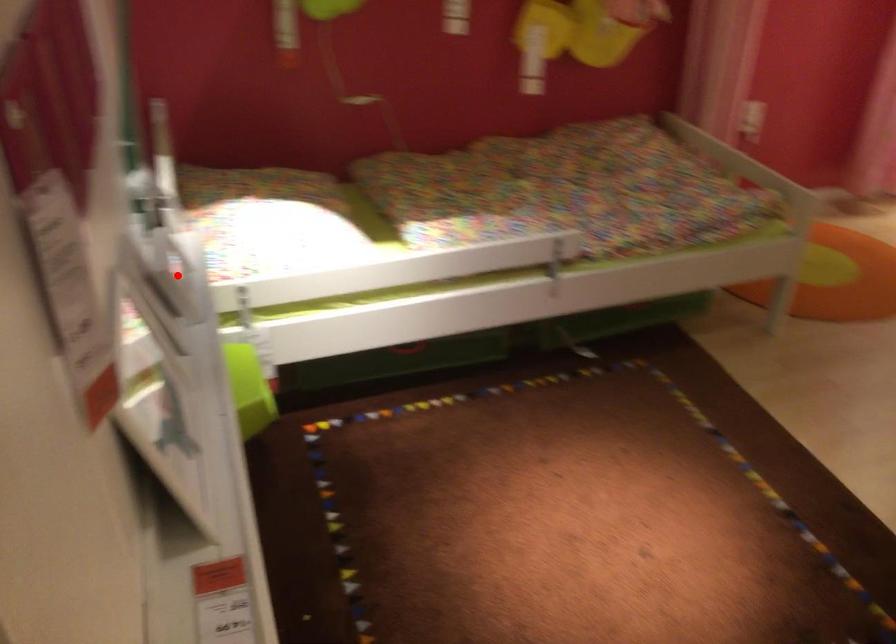
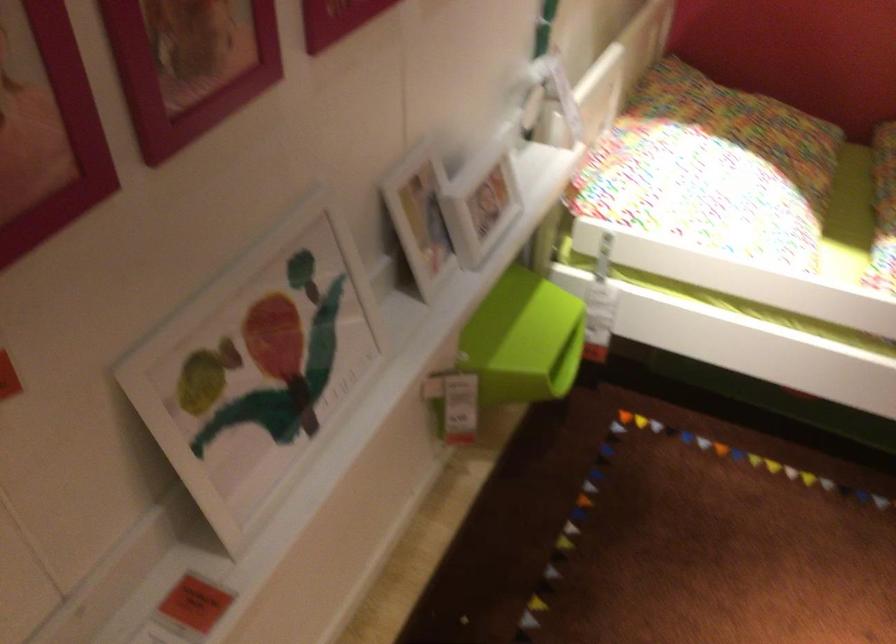
Question: I am providing you with two images of the same scene from different viewpoints. Image1 has a red point marked. In image2, the corresponding 3D location appears at what relative position? Reply with the corresponding letter.

Choices:
 (A) Closer
 (B) Farther

Answer: (A)